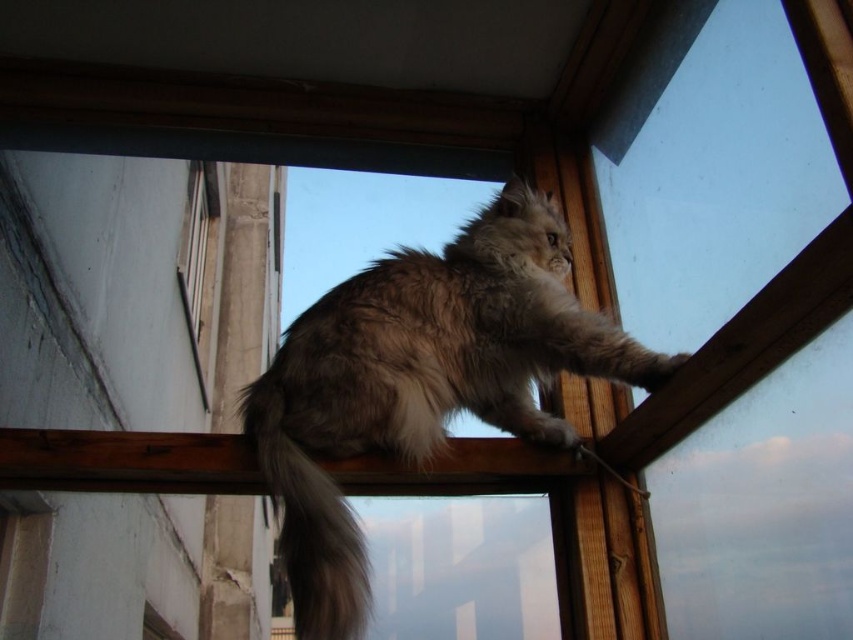
Is point (329, 632) in front of point (189, 225)?

Yes.

The image size is (853, 640). What do you see at coordinates (308, 522) in the screenshot?
I see `fuzzy fur tail at upper center` at bounding box center [308, 522].

This screenshot has height=640, width=853. In order to click on fuzzy fur tail at upper center in this screenshot , I will do `click(308, 522)`.

Which is behind, point (465, 300) or point (177, 256)?

The point (177, 256) is more distant.

Can you confirm if fuzzy fur cat at upper center is positioned to the left of transparent plastic window at center?

In fact, fuzzy fur cat at upper center is to the right of transparent plastic window at center.

The image size is (853, 640). In order to click on fuzzy fur cat at upper center in this screenshot , I will do `click(421, 380)`.

Locate an element on the screen. The width and height of the screenshot is (853, 640). fuzzy fur cat at upper center is located at coordinates (421, 380).

Consider the image. Which of these two, fuzzy fur cat at upper center or fuzzy fur tail at upper center, stands shorter?

fuzzy fur tail at upper center is shorter.

Which is more to the left, fuzzy fur cat at upper center or fuzzy fur tail at upper center?

From the viewer's perspective, fuzzy fur tail at upper center appears more on the left side.

Between point (392, 320) and point (257, 397), which one is positioned behind?

Positioned behind is point (392, 320).

The width and height of the screenshot is (853, 640). What are the coordinates of `fuzzy fur cat at upper center` in the screenshot? It's located at (421, 380).